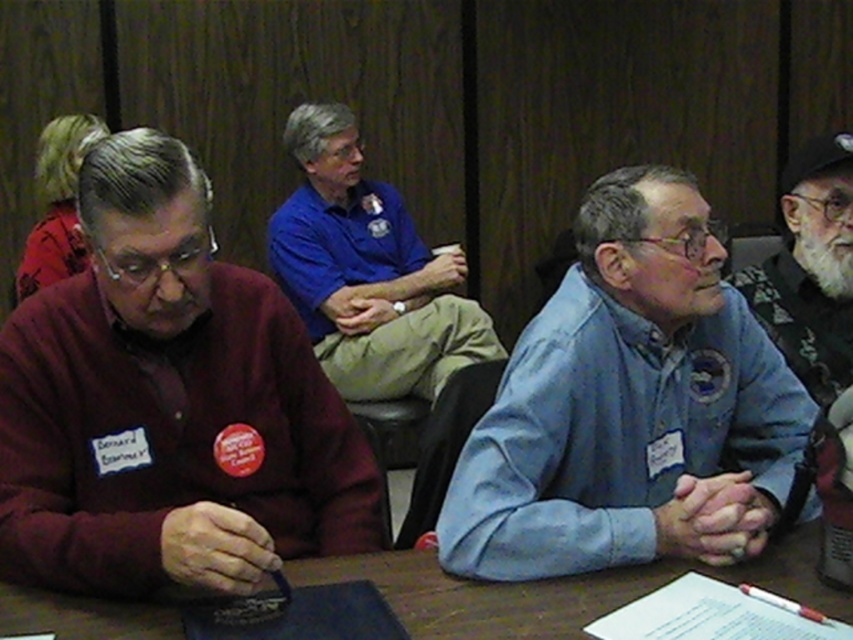
Question: Which point is closer to the camera taking this photo?

Choices:
 (A) (230, 268)
 (B) (392, 307)
 (C) (387, 556)

Answer: (C)

Question: Is wooden table at center bigger than white beard at upper right?

Choices:
 (A) no
 (B) yes

Answer: (A)

Question: Is maroon sweater at left closer to the viewer compared to blue cotton shirt at center?

Choices:
 (A) no
 (B) yes

Answer: (B)

Question: Among these points, which one is farthest from the camera?

Choices:
 (A) click(793, 307)
 (B) click(318, 275)
 (C) click(244, 394)
 (D) click(572, 604)

Answer: (B)

Question: Is maroon sweater at left to the left of blue denim shirt at center from the viewer's perspective?

Choices:
 (A) yes
 (B) no

Answer: (A)

Question: Based on their relative distances, which object is nearer to the wooden table at center?

Choices:
 (A) blue cotton shirt at center
 (B) blue denim shirt at center
 (C) white beard at upper right
 (D) maroon sweater at left

Answer: (B)